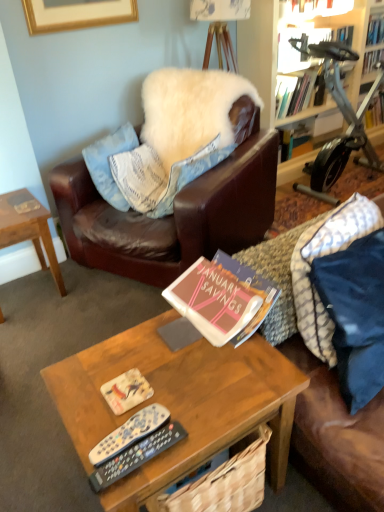
Find the location of a particular element. free space behind matte paper book cover at center is located at coordinates (145, 347).